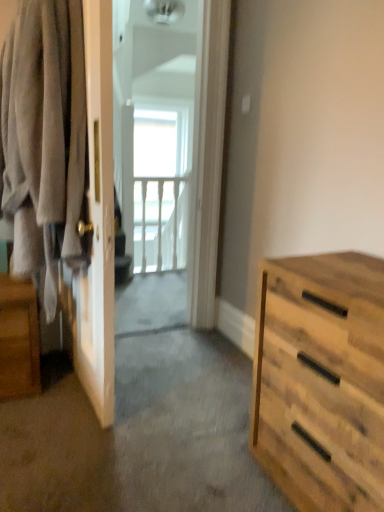
Question: Is natural wood dresser at right surrounding white glossy screen door at center?

Choices:
 (A) yes
 (B) no

Answer: (B)

Question: From the image's perspective, does natural wood dresser at right appear higher than white glossy screen door at center?

Choices:
 (A) no
 (B) yes

Answer: (A)

Question: Can you confirm if natural wood dresser at right is thinner than white glossy screen door at center?

Choices:
 (A) yes
 (B) no

Answer: (B)

Question: Would you consider natural wood dresser at right to be distant from white glossy screen door at center?

Choices:
 (A) no
 (B) yes

Answer: (B)

Question: Is natural wood dresser at right smaller than white glossy screen door at center?

Choices:
 (A) yes
 (B) no

Answer: (B)

Question: Is natural wood dresser at right at the left side of white glossy screen door at center?

Choices:
 (A) no
 (B) yes

Answer: (A)

Question: Would you say soft gray fabric at left is outside wooden nightstand at left?

Choices:
 (A) yes
 (B) no

Answer: (A)

Question: Is soft gray fabric at left closer to camera compared to wooden nightstand at left?

Choices:
 (A) no
 (B) yes

Answer: (B)

Question: Does soft gray fabric at left have a lesser width compared to wooden nightstand at left?

Choices:
 (A) no
 (B) yes

Answer: (B)

Question: Are soft gray fabric at left and wooden nightstand at left located far from each other?

Choices:
 (A) yes
 (B) no

Answer: (B)

Question: From a real-world perspective, is soft gray fabric at left positioned over wooden nightstand at left based on gravity?

Choices:
 (A) no
 (B) yes

Answer: (B)

Question: Considering the relative sizes of soft gray fabric at left and wooden nightstand at left in the image provided, is soft gray fabric at left taller than wooden nightstand at left?

Choices:
 (A) no
 (B) yes

Answer: (B)

Question: From the image's perspective, would you say white wooden balustrade at upper center is positioned over wooden nightstand at left?

Choices:
 (A) no
 (B) yes

Answer: (B)